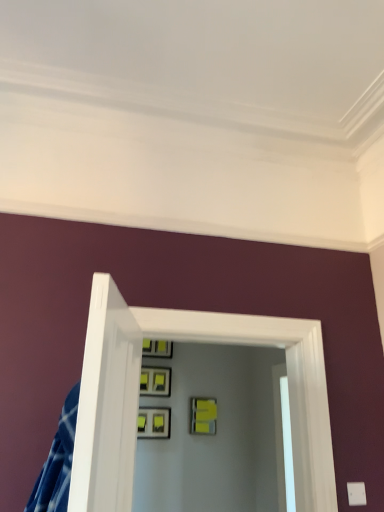
Question: Is matte black picture frame at upper center, which is the fourth picture frame in bottom-to-top order, aimed at matte gray picture frame at center, the fourth picture frame when ordered from top to bottom?

Choices:
 (A) yes
 (B) no

Answer: (B)

Question: Is matte black picture frame at upper center, which is the fourth picture frame in bottom-to-top order, thinner than matte gray picture frame at center, positioned as the 1th picture frame in bottom-to-top order?

Choices:
 (A) yes
 (B) no

Answer: (B)

Question: Can you confirm if matte black picture frame at upper center, which is the fourth picture frame in bottom-to-top order, is positioned to the left of matte gray picture frame at center, the fourth picture frame when ordered from top to bottom?

Choices:
 (A) no
 (B) yes

Answer: (A)

Question: From the image's perspective, is matte black picture frame at upper center, which is the fourth picture frame in bottom-to-top order, beneath matte gray picture frame at center, the fourth picture frame when ordered from top to bottom?

Choices:
 (A) no
 (B) yes

Answer: (A)

Question: Is matte black picture frame at upper center, the first picture frame positioned from the top, at the right side of matte gray picture frame at center, the fourth picture frame when ordered from top to bottom?

Choices:
 (A) no
 (B) yes

Answer: (B)

Question: From a real-world perspective, is matte black picture frame at upper center, which is the fourth picture frame in bottom-to-top order, under matte gray picture frame at center, positioned as the 1th picture frame in bottom-to-top order?

Choices:
 (A) yes
 (B) no

Answer: (B)

Question: Is clear glass door at center positioned far away from matte black picture frame at center, which appears as the 3th picture frame when ordered from the bottom?

Choices:
 (A) no
 (B) yes

Answer: (B)

Question: Is clear glass door at center in front of matte black picture frame at center, which appears as the 3th picture frame when ordered from the bottom?

Choices:
 (A) no
 (B) yes

Answer: (B)

Question: Does clear glass door at center have a lesser width compared to matte black picture frame at center, the 2th picture frame viewed from the top?

Choices:
 (A) yes
 (B) no

Answer: (B)

Question: From a real-world perspective, does clear glass door at center sit lower than matte black picture frame at center, the 2th picture frame viewed from the top?

Choices:
 (A) no
 (B) yes

Answer: (B)

Question: Is clear glass door at center wider than matte black picture frame at center, the 2th picture frame viewed from the top?

Choices:
 (A) yes
 (B) no

Answer: (A)

Question: Considering the relative positions of clear glass door at center and matte black picture frame at center, the 2th picture frame viewed from the top, in the image provided, is clear glass door at center to the right of matte black picture frame at center, the 2th picture frame viewed from the top, from the viewer's perspective?

Choices:
 (A) no
 (B) yes

Answer: (B)

Question: Is clear glass door at center completely or partially inside matte black picture frame at upper center, the first picture frame positioned from the top?

Choices:
 (A) no
 (B) yes

Answer: (A)